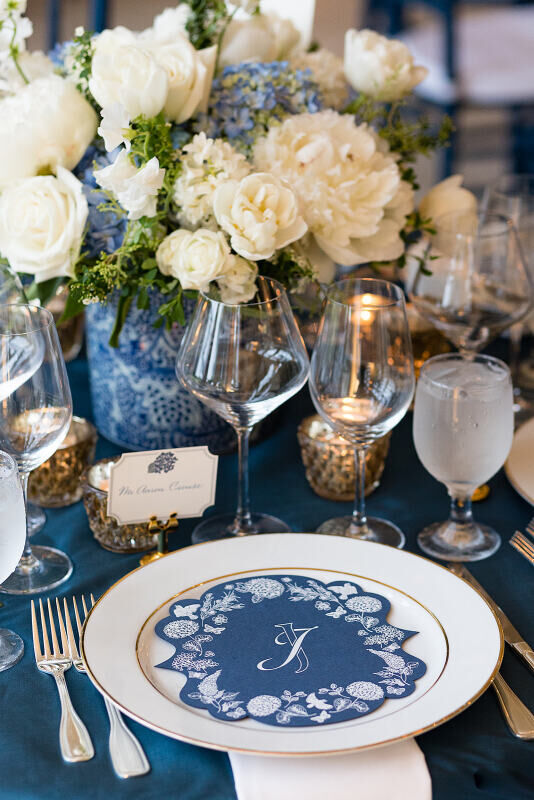
Image resolution: width=534 pixels, height=800 pixels. I want to click on candle, so click(327, 465), click(102, 509), click(85, 449), click(422, 346), click(366, 298).